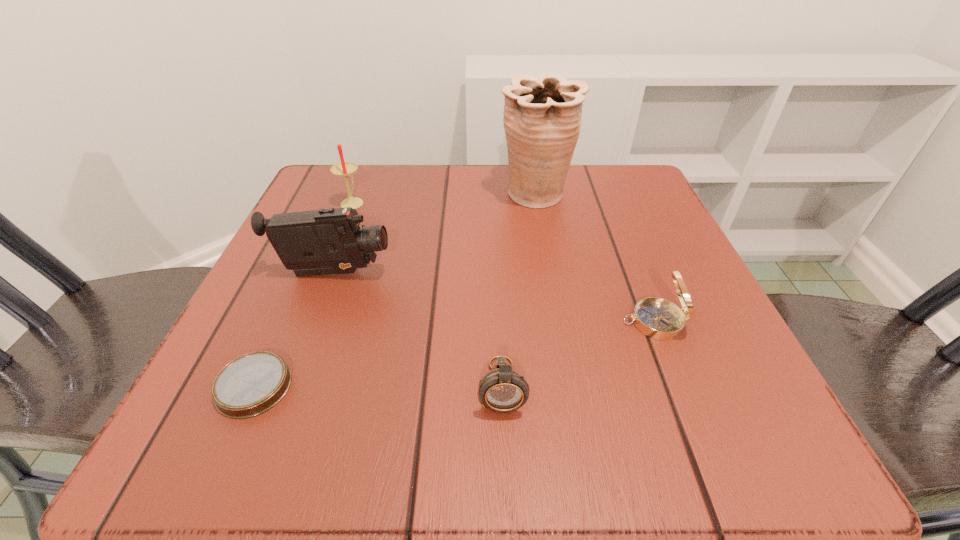
Identify the location of vacant space at the near right corner of the desktop. (671, 416).

Where is `free spot between the farthest compass and the second compass from left to right`? The width and height of the screenshot is (960, 540). free spot between the farthest compass and the second compass from left to right is located at coordinates (578, 354).

What are the coordinates of `empty location between the fourth farthest object and the camcorder` in the screenshot? It's located at (493, 298).

I want to click on vacant space that's between the candle and the urn, so click(x=444, y=199).

The height and width of the screenshot is (540, 960). I want to click on free point between the fourth nearest object and the second compass from right to left, so click(x=418, y=330).

Identify the location of vacant area that lies between the tallest object and the fourth nearest object. (435, 234).

I want to click on free point between the shortest compass and the urn, so click(395, 291).

The image size is (960, 540). What are the coordinates of `empty space that is in between the rightmost compass and the candle` in the screenshot? It's located at (503, 262).

Where is `vacant point located between the shortest object and the candle`? vacant point located between the shortest object and the candle is located at coordinates (303, 294).

The image size is (960, 540). Find the location of `object that is the fifth nearest to the rightmost object`. object that is the fifth nearest to the rightmost object is located at coordinates (345, 169).